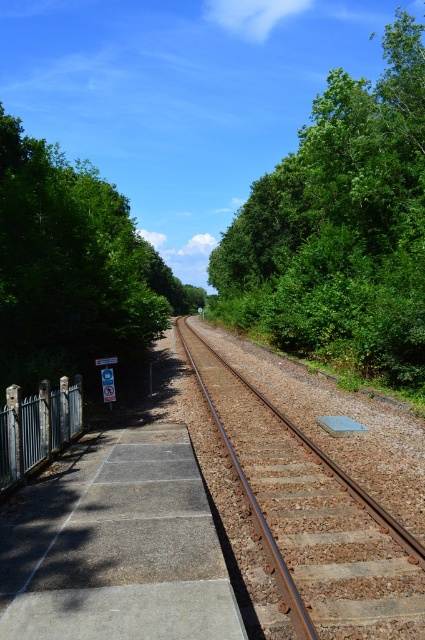
Is point (385, 612) farther from camera compared to point (68, 410)?

No, (385, 612) is in front of (68, 410).

What do you see at coordinates (309, 513) in the screenshot?
I see `rusty metal train track at center` at bounding box center [309, 513].

Measure the distance between rusty metal train track at center and camera.

rusty metal train track at center is 4.45 meters from camera.

Find the location of a particular element. This screenshot has width=425, height=640. rusty metal train track at center is located at coordinates (309, 513).

Is green leafy tree at left positioned in front of rusty metal train track at center?

No, green leafy tree at left is behind rusty metal train track at center.

How much distance is there between green leafy tree at left and rusty metal train track at center?

green leafy tree at left is 113.23 feet away from rusty metal train track at center.

Where is `green leafy tree at left`? This screenshot has width=425, height=640. green leafy tree at left is located at coordinates (70, 266).

Find the location of a particular element. This screenshot has height=640, width=425. green leafy tree at left is located at coordinates (70, 266).

Describe the element at coordinates (342, 225) in the screenshot. I see `green leafy tree at upper right` at that location.

Between point (326, 298) and point (37, 266), which one is positioned behind?

Point (326, 298)

Measure the distance between point (385, 241) and camera.

Point (385, 241) and camera are 24.56 meters apart.

Locate an element on the screen. This screenshot has height=640, width=425. green leafy tree at upper right is located at coordinates (342, 225).